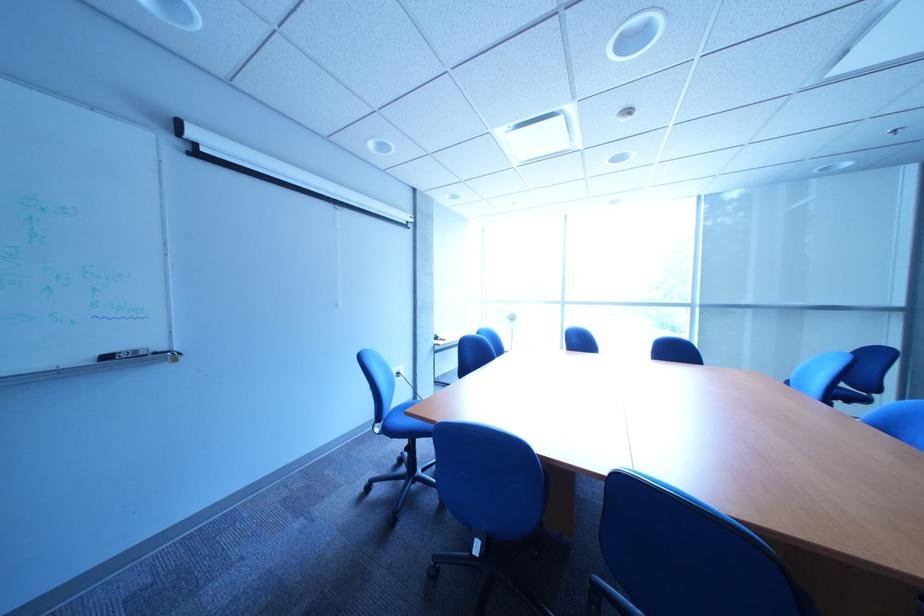
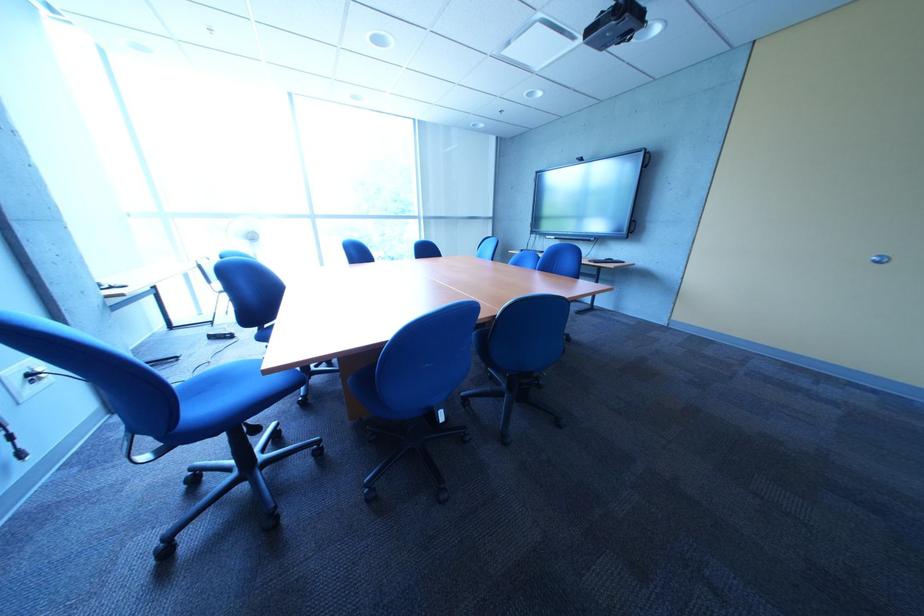
In the second image, find the point that corresponds to point (412, 375) in the first image.

(46, 377)